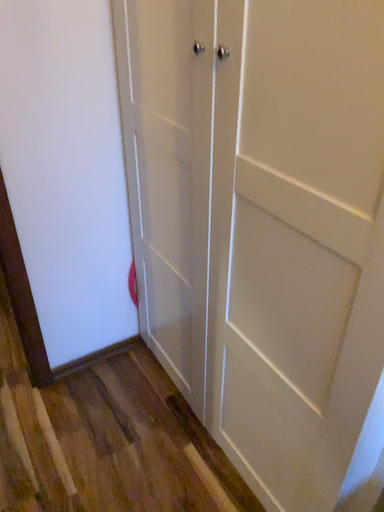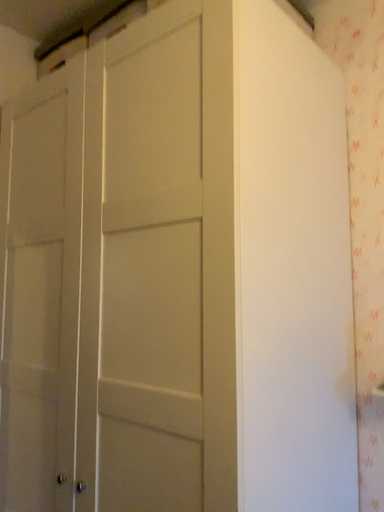
Question: Which way did the camera rotate in the video?

Choices:
 (A) rotated right
 (B) rotated left

Answer: (A)